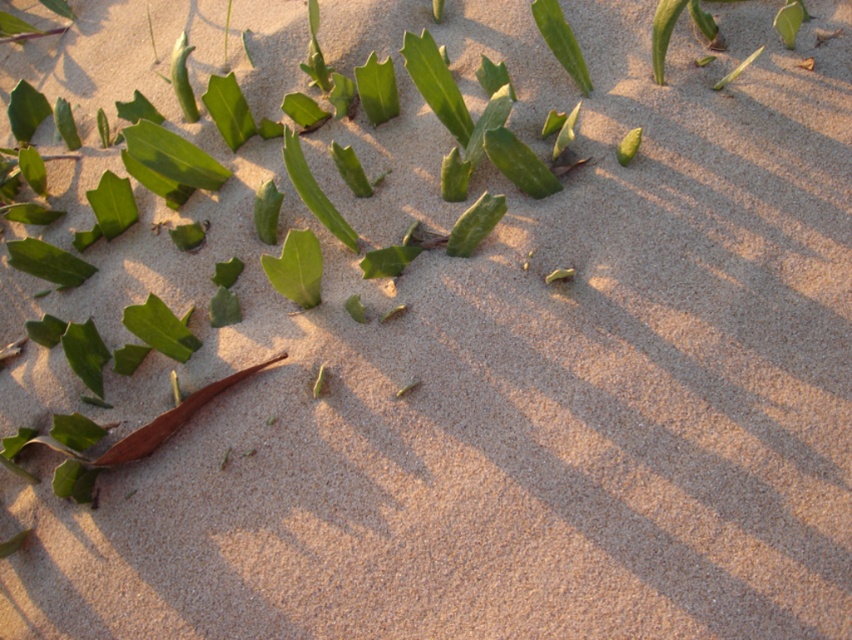
Does green matte leaf at center have a larger size compared to green matte leaf at upper center?

Indeed, green matte leaf at center has a larger size compared to green matte leaf at upper center.

Does green matte leaf at center have a smaller size compared to green matte leaf at upper center?

Incorrect, green matte leaf at center is not smaller in size than green matte leaf at upper center.

Find the location of `green matte leaf at center`. green matte leaf at center is located at coordinates (x=296, y=268).

I want to click on green matte leaf at center, so click(296, 268).